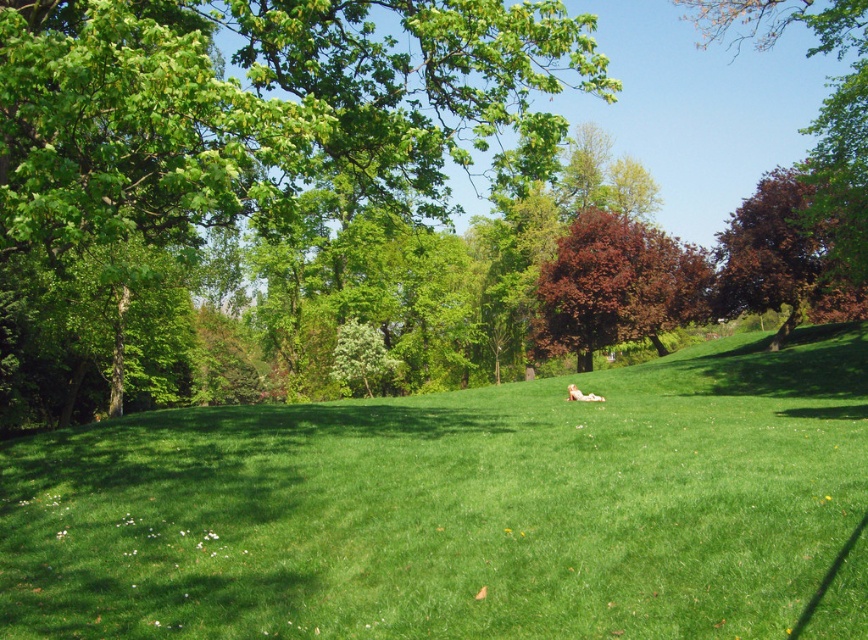
Question: Can you confirm if dark brown textured tree at upper right is thinner than white fluffy dog at center?

Choices:
 (A) no
 (B) yes

Answer: (A)

Question: Which of the following is the closest to the observer?

Choices:
 (A) (408, 588)
 (B) (189, 221)

Answer: (A)

Question: Is dark red leafy tree at center positioned in front of brown leafy tree at upper right?

Choices:
 (A) yes
 (B) no

Answer: (B)

Question: Based on their relative distances, which object is farther from the brown leafy tree at upper right?

Choices:
 (A) green leafy tree at upper left
 (B) dark red leafy tree at center
 (C) white fluffy dog at center
 (D) green grassy field at center

Answer: (C)

Question: Does green leafy tree at upper left lie in front of dark brown textured tree at upper right?

Choices:
 (A) no
 (B) yes

Answer: (B)

Question: Which of the following is the farthest from the observer?

Choices:
 (A) (865, 93)
 (B) (797, 508)

Answer: (A)